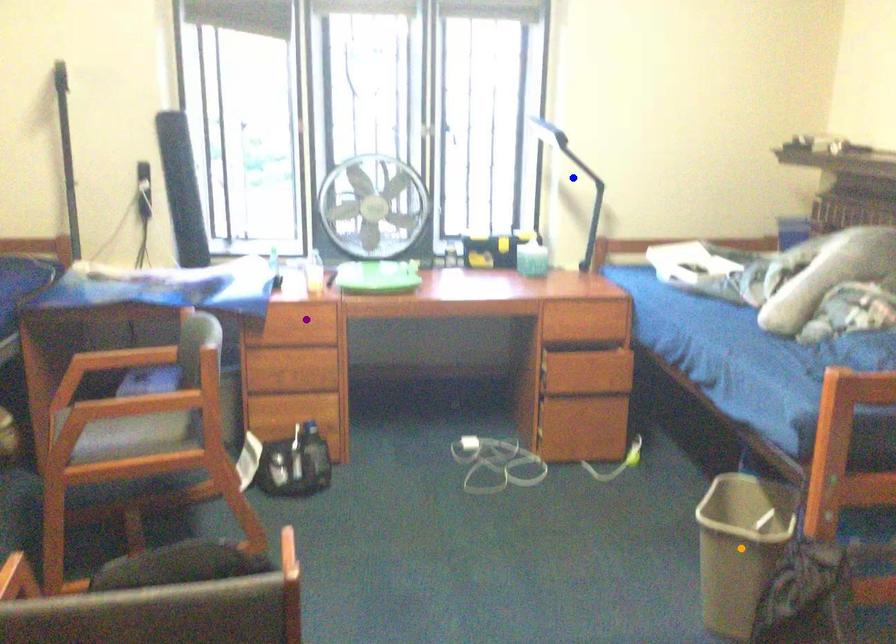
Order these from nearest to farthest:
1. orange point
2. blue point
3. purple point

blue point → purple point → orange point